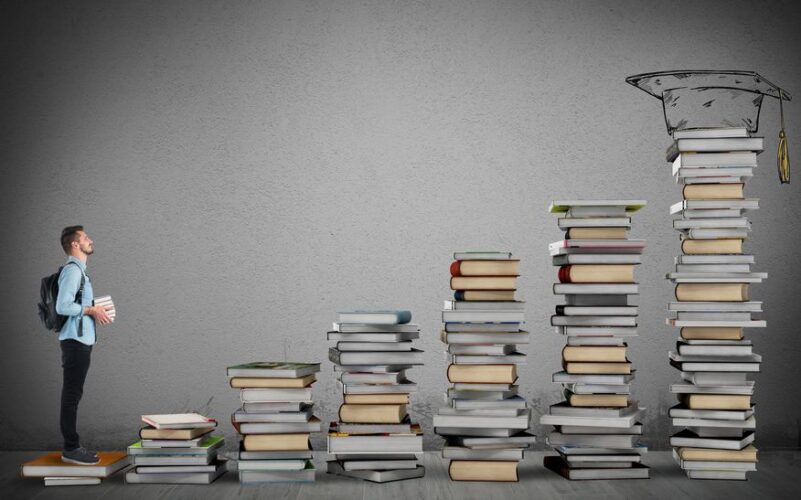
In order to click on books in 3rd stack from the left in this screenshot , I will do `click(246, 370)`, `click(255, 383)`, `click(266, 394)`, `click(271, 409)`, `click(283, 414)`, `click(291, 428)`, `click(275, 442)`, `click(280, 452)`, `click(275, 467)`, `click(278, 470)`.